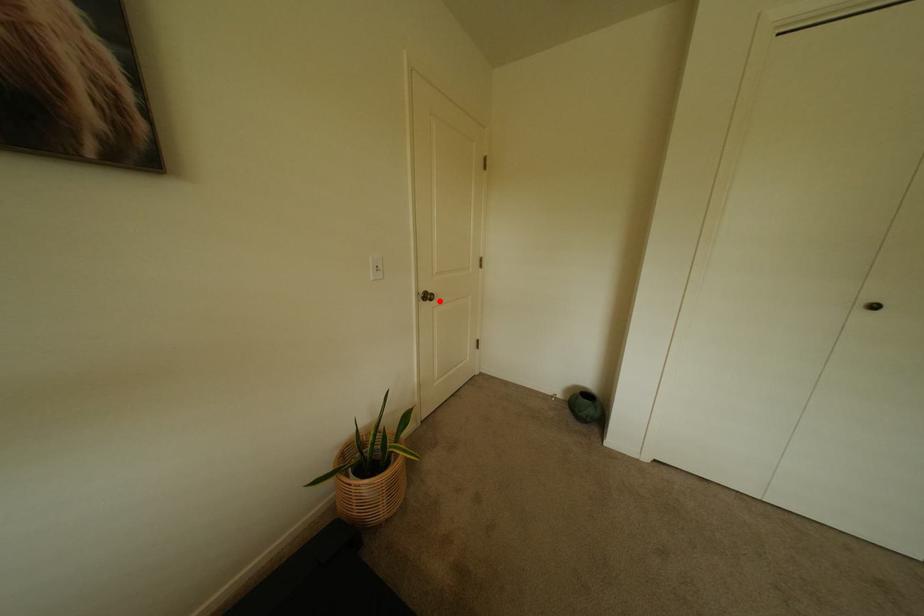
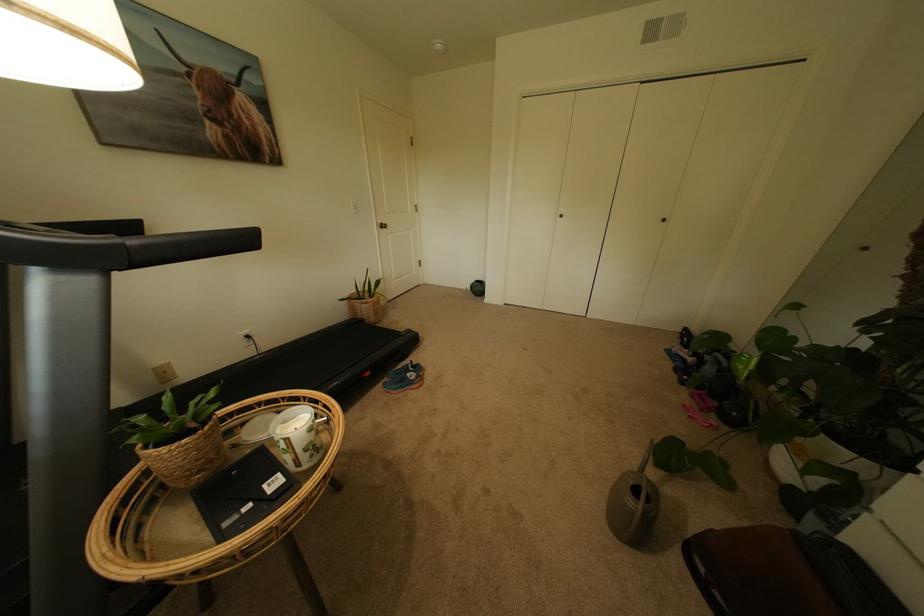
Question: I am providing you with two images of the same scene from different viewpoints. A red point is shown in image1. For the corresponding object point in image2, is it positioned nearer or farther from the camera?

Choices:
 (A) Nearer
 (B) Farther

Answer: (A)